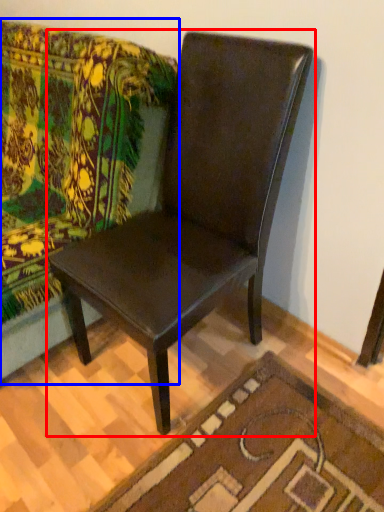
Question: Which point is further to the camera, chair (highlighted by a red box) or studio couch (highlighted by a blue box)?

Choices:
 (A) chair
 (B) studio couch

Answer: (B)